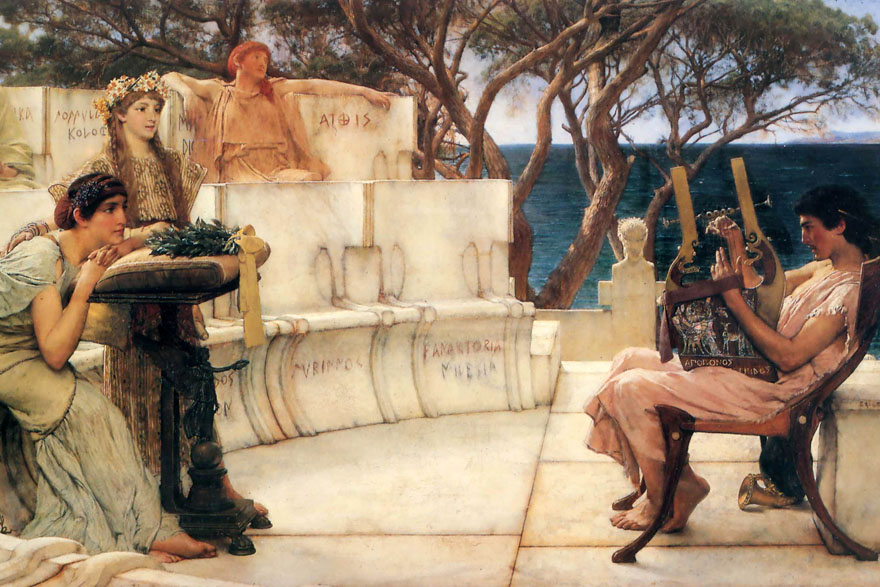
Find the location of `chair legs`. chair legs is located at coordinates (822, 521), (656, 525), (627, 502), (760, 441).